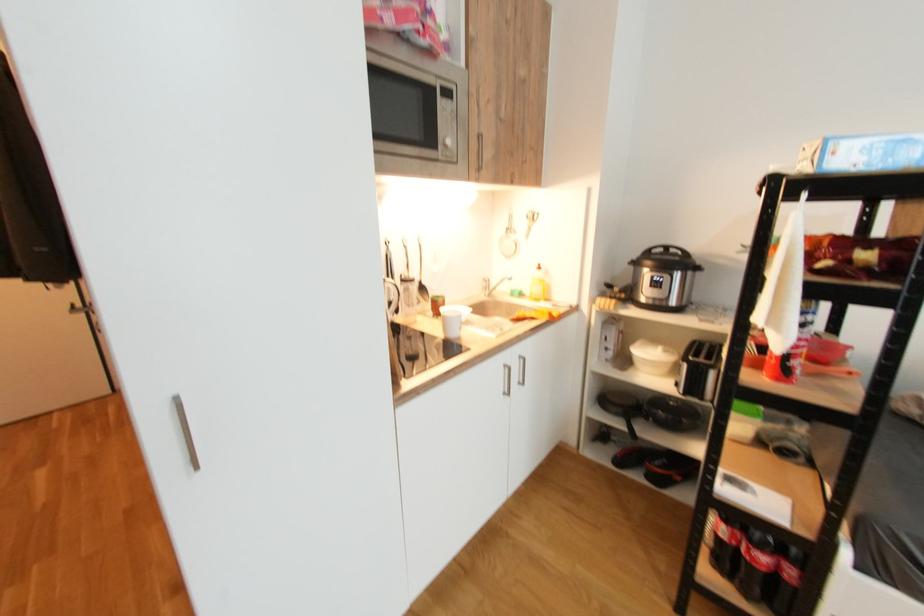
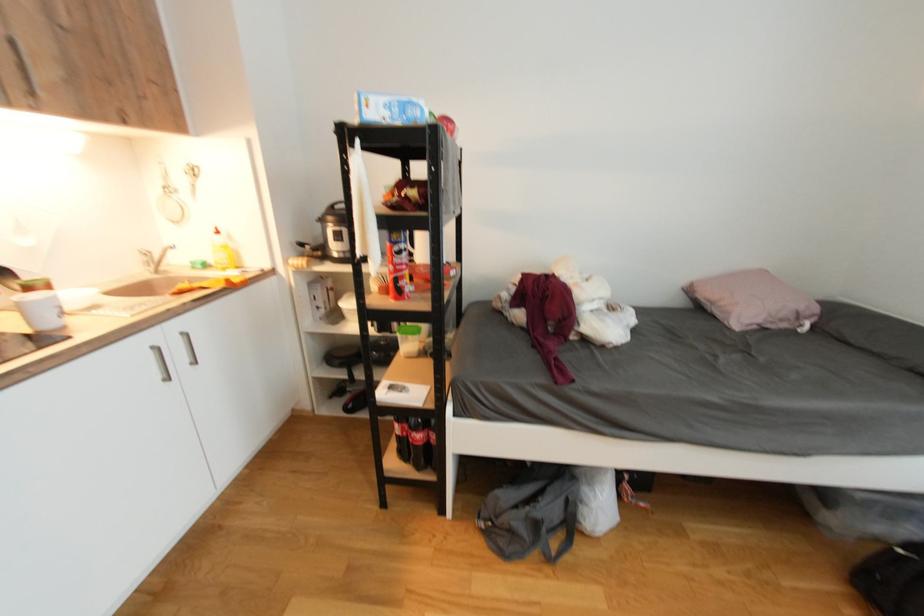
Question: The camera is either moving clockwise (left) or counter-clockwise (right) around the object. The first image is from the beginning of the video and the second image is from the end. Is the camera moving left or right when shooting the video?

Choices:
 (A) Left
 (B) Right

Answer: (A)